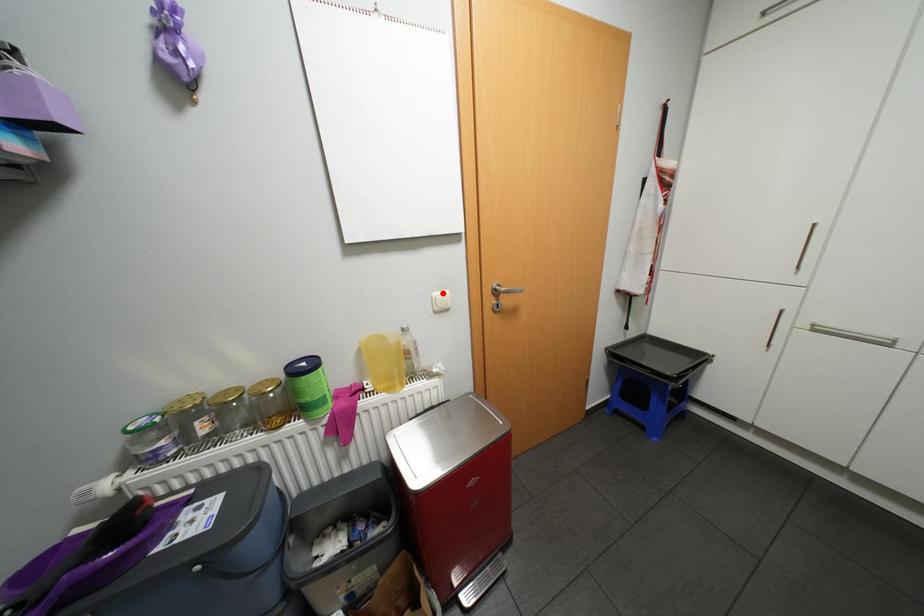
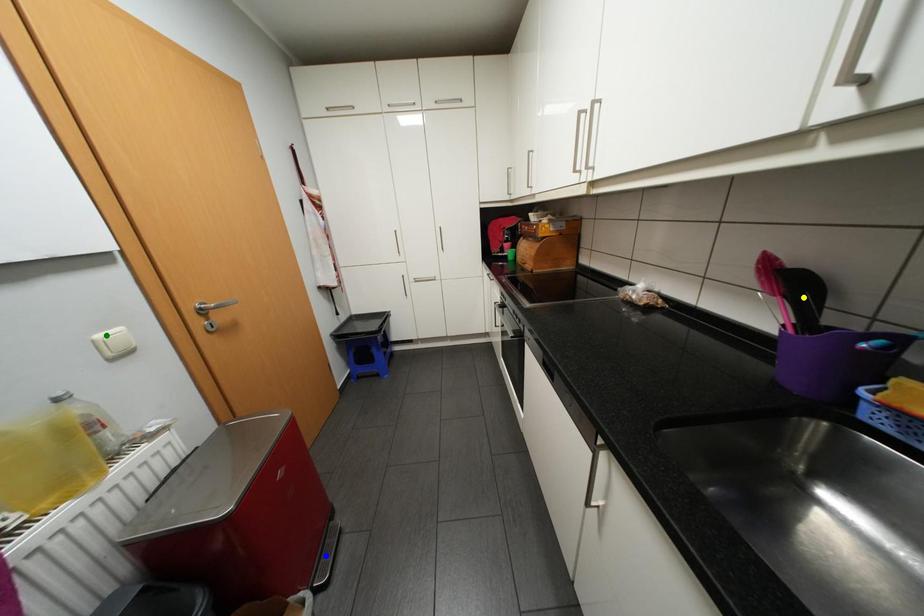
Question: I am providing you with two images of the same scene from different viewpoints. A red point is marked on the first image. You are given multiple points on the second image. Which mark in image 2 goes with the point in image 1?

Choices:
 (A) yellow point
 (B) green point
 (C) blue point

Answer: (B)